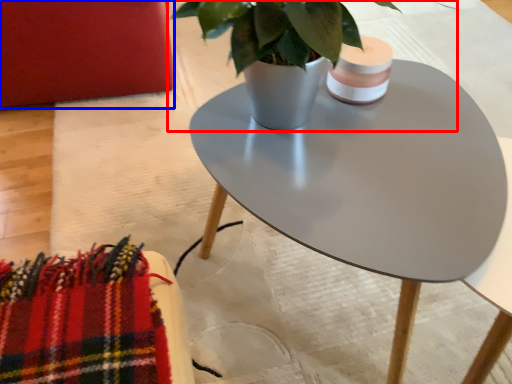
Question: Which object is closer to the camera taking this photo, houseplant (highlighted by a red box) or armchair (highlighted by a blue box)?

Choices:
 (A) houseplant
 (B) armchair

Answer: (A)